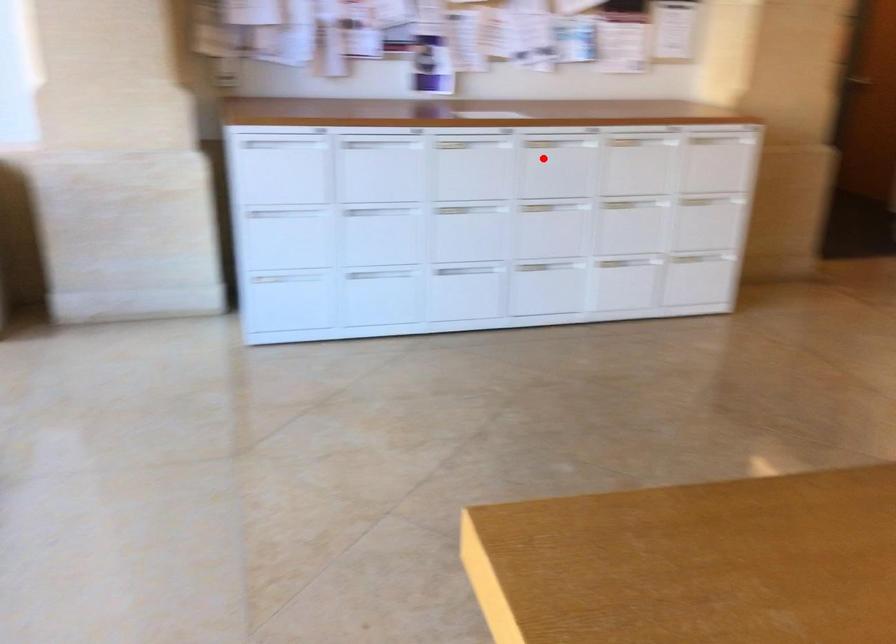
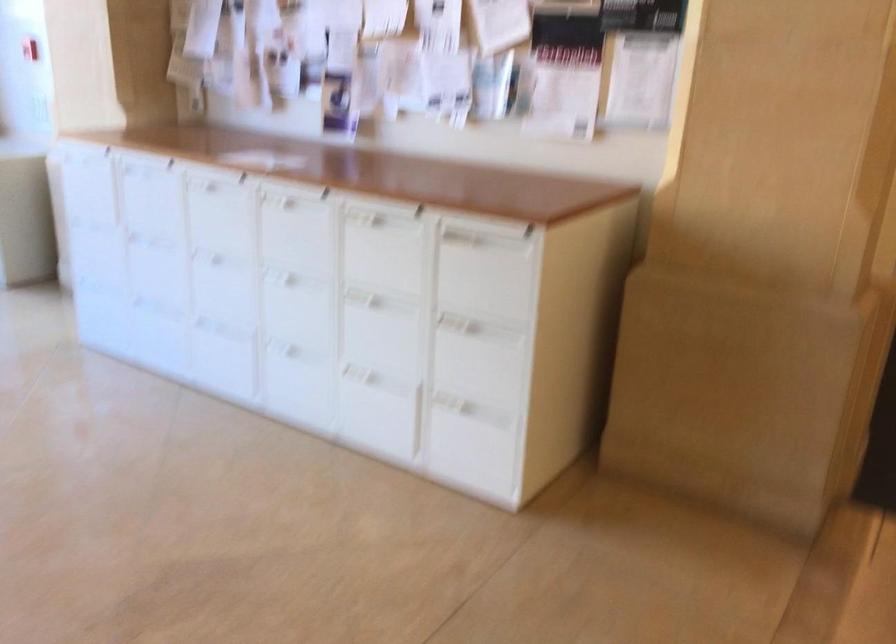
The point at the highlighted location is marked in the first image. Where is the corresponding point in the second image?

(295, 228)